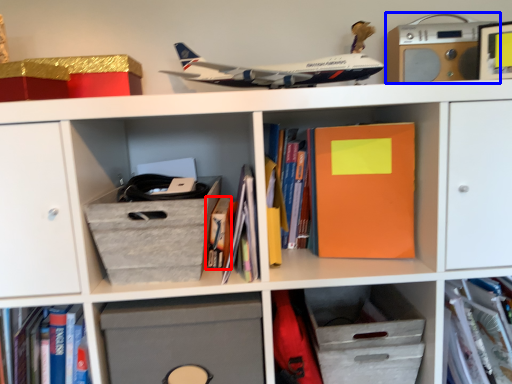
Question: Which object appears closest to the camera in this image, book (highlighted by a red box) or stereo (highlighted by a blue box)?

Choices:
 (A) book
 (B) stereo

Answer: (A)